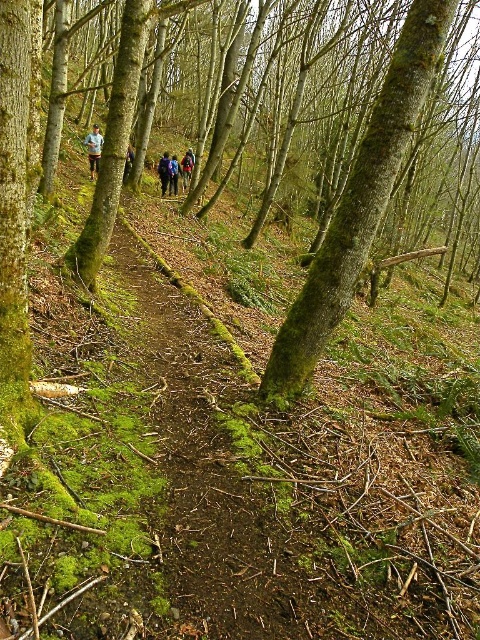
Is point (96, 128) farther from viewer compared to point (170, 184)?

No, it is not.

What do you see at coordinates (94, 148) in the screenshot?
I see `light blue shirt at center` at bounding box center [94, 148].

Where is `light blue shirt at center`? light blue shirt at center is located at coordinates (94, 148).

Is point (267, 369) positioned after point (170, 189)?

No, it is not.

Does green mossy tree trunk at center come in front of camouflage jacket at center?

Yes.

Find the location of a particular element. This screenshot has width=480, height=640. green mossy tree trunk at center is located at coordinates (359, 202).

At what (x,y) coordinates should I click in order to perform the action: click on green mossy tree trunk at center. Please return your answer as a coordinate pair (x, y). The height and width of the screenshot is (640, 480). Looking at the image, I should click on (359, 202).

Is green mossy tree at center bigger than green mossy tree trunk at center?

A: Yes.

Which is below, green mossy tree at center or green mossy tree trunk at center?

green mossy tree trunk at center is below.

Where is `green mossy tree at center`? The image size is (480, 640). green mossy tree at center is located at coordinates (368, 152).